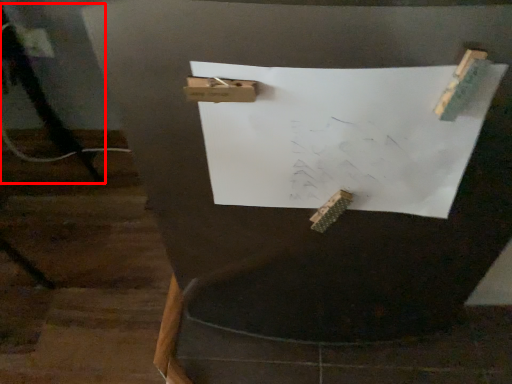
Question: Considering the relative positions of tripod (annotated by the red box) and paper in the image provided, where is tripod (annotated by the red box) located with respect to the staircase?

Choices:
 (A) left
 (B) right

Answer: (A)